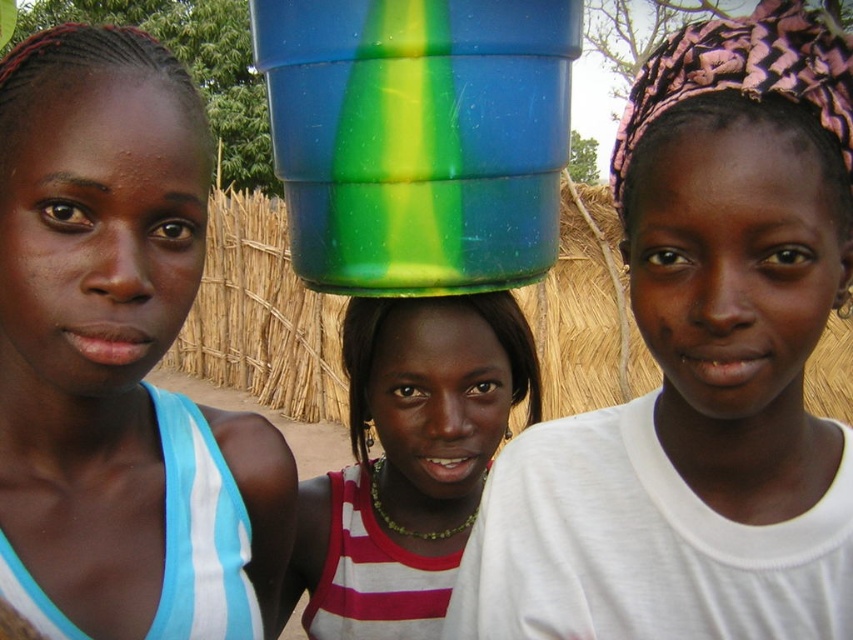
Based on the scene, which object is taller between the matte blue tank top at left and the green translucent bucket at center?

The matte blue tank top at left is taller than the green translucent bucket at center.

You are a photographer trying to capture the green plastic bucket at center and the green translucent bucket at center in the image. Which bucket appears closer to the camera?

The green plastic bucket at center appears closer to the camera because it is in front of the green translucent bucket at center.